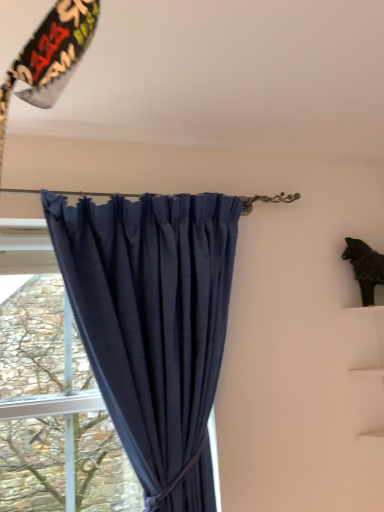
Question: From the image's perspective, is navy blue fabric curtain at center located beneath black matte cat at upper right?

Choices:
 (A) yes
 (B) no

Answer: (A)

Question: Does navy blue fabric curtain at center have a smaller size compared to black matte cat at upper right?

Choices:
 (A) no
 (B) yes

Answer: (A)

Question: From a real-world perspective, is navy blue fabric curtain at center positioned over black matte cat at upper right based on gravity?

Choices:
 (A) yes
 (B) no

Answer: (B)

Question: Is the surface of navy blue fabric curtain at center in direct contact with black matte cat at upper right?

Choices:
 (A) no
 (B) yes

Answer: (A)

Question: Is navy blue fabric curtain at center at the right side of black matte cat at upper right?

Choices:
 (A) yes
 (B) no

Answer: (B)

Question: Is navy blue fabric curtain at center facing away from black matte cat at upper right?

Choices:
 (A) yes
 (B) no

Answer: (B)

Question: Does black matte cat at upper right lie behind green leafy tree at left?

Choices:
 (A) yes
 (B) no

Answer: (A)

Question: Does black matte cat at upper right have a lesser width compared to green leafy tree at left?

Choices:
 (A) yes
 (B) no

Answer: (B)

Question: Is black matte cat at upper right at the right side of green leafy tree at left?

Choices:
 (A) no
 (B) yes

Answer: (B)

Question: Can you confirm if black matte cat at upper right is shorter than green leafy tree at left?

Choices:
 (A) no
 (B) yes

Answer: (B)

Question: Is black matte cat at upper right outside green leafy tree at left?

Choices:
 (A) no
 (B) yes

Answer: (B)

Question: Is the position of black matte cat at upper right less distant than that of green leafy tree at left?

Choices:
 (A) no
 (B) yes

Answer: (A)

Question: Can you confirm if green leafy tree at left is smaller than navy blue fabric curtain at center?

Choices:
 (A) yes
 (B) no

Answer: (A)